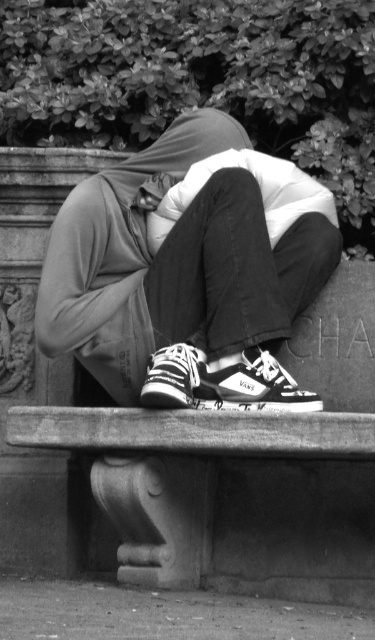
You are a fashion designer observing the scene. You need to determine if the matte black hoodie at center can be placed on the smooth stone bench at center without folding. Can you confirm based on their sizes?

The matte black hoodie at center has a greater height compared to the smooth stone bench at center, so it cannot be placed on the bench without folding.

You are a photographer trying to capture a closeup of the smooth stone bench at center without the matte black hoodie at center blocking the view. Can you move the bench or the hoodie to achieve this?

The matte black hoodie at center is in front of the smooth stone bench at center, so you can move the matte black hoodie at center out of the way to get an unobstructed view of the bench.